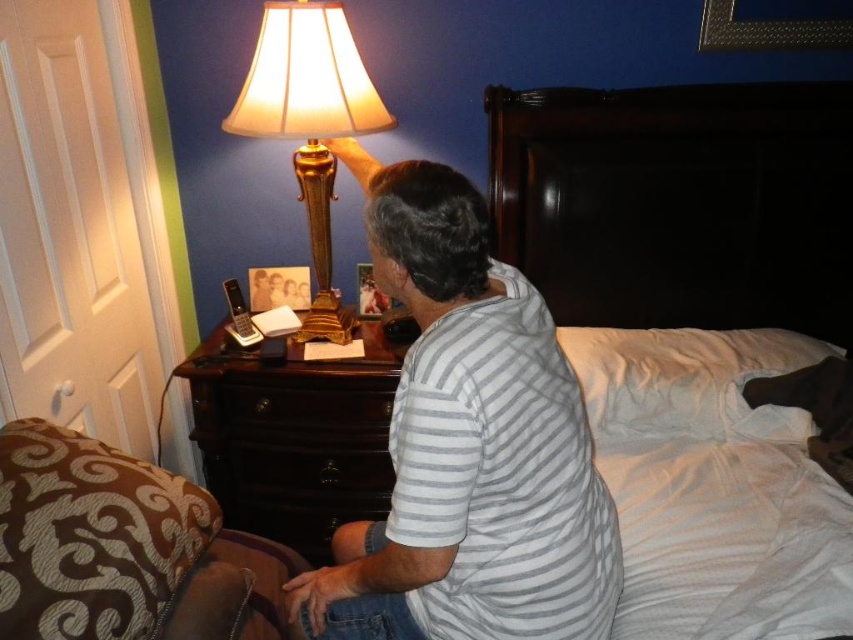
Question: Is the position of gray striped shirt at center less distant than that of dark wood dresser at lower left?

Choices:
 (A) yes
 (B) no

Answer: (A)

Question: Is gray striped shirt at center bigger than white soft bed at center?

Choices:
 (A) yes
 (B) no

Answer: (A)

Question: Which point is farther to the camera?

Choices:
 (A) (387, 422)
 (B) (225, 566)

Answer: (A)

Question: Estimate the real-world distances between objects in this image. Which object is farther from the brown textured fabric at lower left?

Choices:
 (A) gray striped shirt at center
 (B) white soft bed at center
 (C) gold metallic lamp at upper left
 (D) white soft pillow at upper right

Answer: (B)

Question: From the image, what is the correct spatial relationship of brown textured fabric at lower left in relation to dark wood dresser at lower left?

Choices:
 (A) left
 (B) right

Answer: (A)

Question: Which point appears farthest from the camera in this image?

Choices:
 (A) coord(705,144)
 (B) coord(216,612)
 (C) coord(606,346)
 (D) coord(477,310)

Answer: (A)